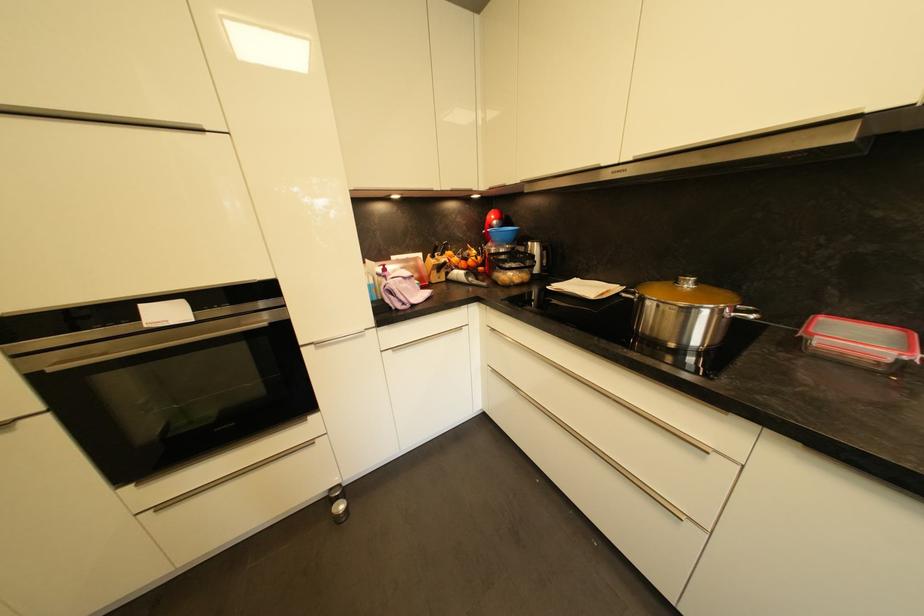
What do you see at coordinates (478, 280) in the screenshot? I see `the knife handle` at bounding box center [478, 280].